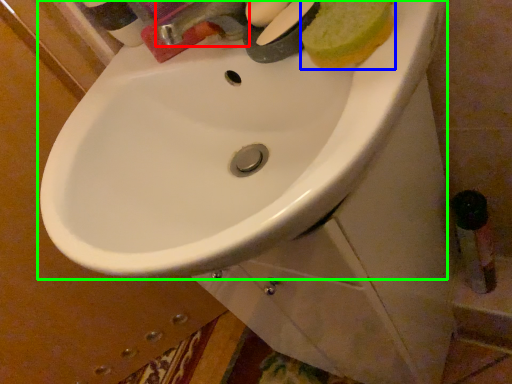
Question: Considering the real-world distances, which object is closest to tap (highlighted by a red box)? food (highlighted by a blue box) or sink (highlighted by a green box).

Choices:
 (A) food
 (B) sink

Answer: (A)